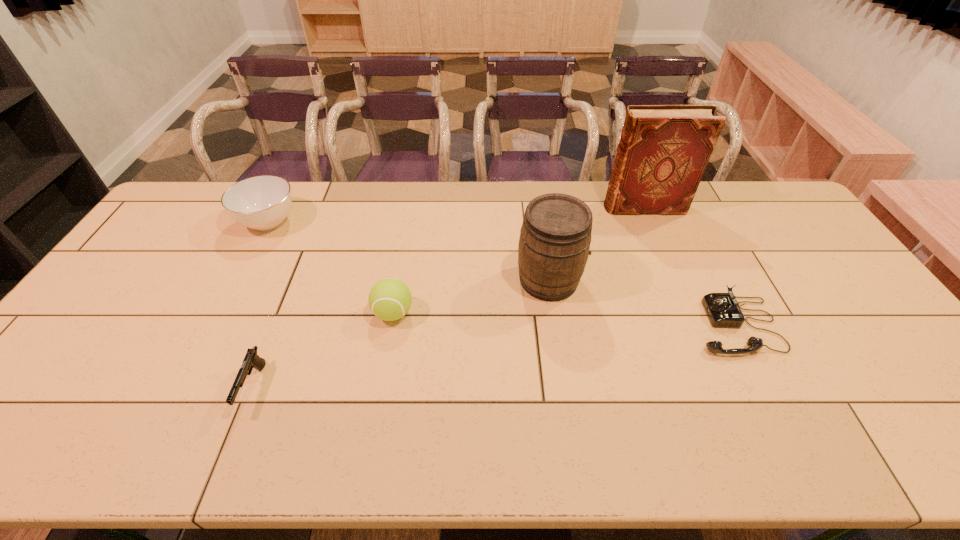
Where is `free space that is in between the telephone and the tallest object`? The height and width of the screenshot is (540, 960). free space that is in between the telephone and the tallest object is located at coordinates (689, 266).

The height and width of the screenshot is (540, 960). In order to click on free area in between the nearest object and the telephone in this screenshot , I will do `click(494, 356)`.

Locate an element on the screen. The height and width of the screenshot is (540, 960). unoccupied area between the telephone and the tallest object is located at coordinates (689, 266).

I want to click on free space between the gun and the third object from right to left, so click(x=401, y=334).

The width and height of the screenshot is (960, 540). What are the coordinates of `object that is the fourth nearest to the second object from left to right` in the screenshot? It's located at (723, 310).

Locate an element on the screen. object that ranks as the fourth closest to the hardback book is located at coordinates (263, 202).